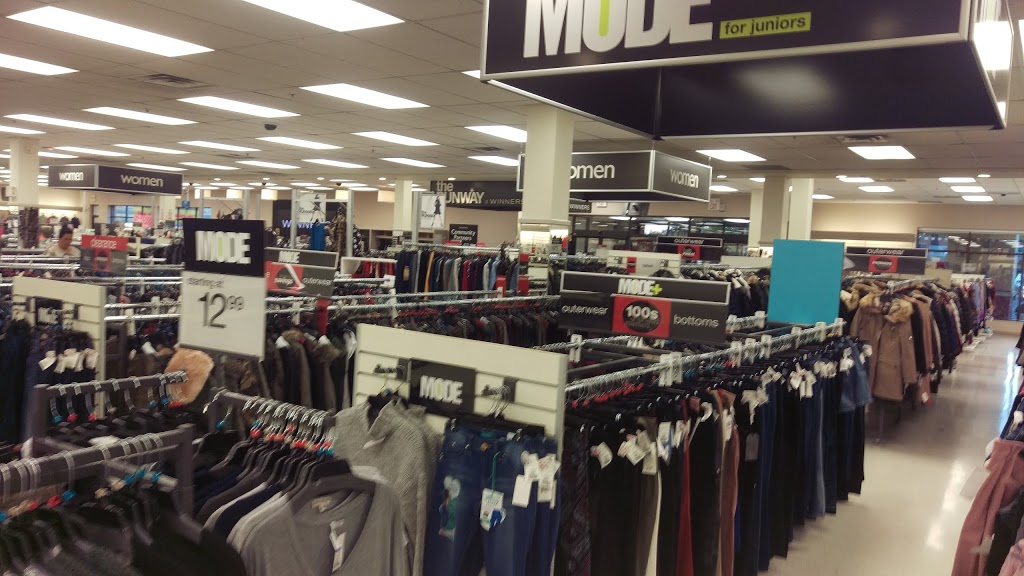
You are a GUI agent. You are given a task and a screenshot of the screen. Output one action in this format:
    pyautogui.click(x=<x>, y=<y>)
    Task: Click on the white pillars
    
    Given the screenshot: What is the action you would take?
    tap(540, 193), tap(798, 219), tap(775, 219), tap(753, 219), tap(397, 214), tap(254, 204), tap(22, 192)